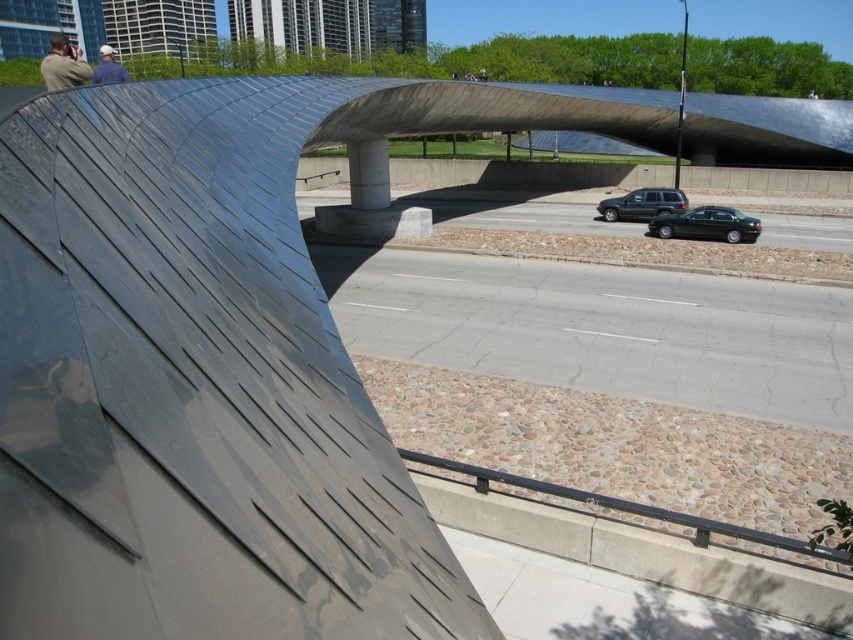
Does gray asphalt highway at center have a smaller size compared to blue denim jacket at upper left?

Yes.

Does gray asphalt highway at center have a greater height compared to blue denim jacket at upper left?

Incorrect, gray asphalt highway at center's height is not larger of blue denim jacket at upper left's.

The height and width of the screenshot is (640, 853). Find the location of `gray asphalt highway at center`. gray asphalt highway at center is located at coordinates (602, 328).

Identify the location of gray asphalt highway at center. (602, 328).

Is gray asphalt highway at center positioned in front of matte black jacket at upper left?

No, it is behind matte black jacket at upper left.

Can you confirm if gray asphalt highway at center is taller than matte black jacket at upper left?

No, gray asphalt highway at center is not taller than matte black jacket at upper left.

Where is `gray asphalt highway at center`? The width and height of the screenshot is (853, 640). gray asphalt highway at center is located at coordinates (602, 328).

Which is more to the right, matte black jacket at upper left or blue denim jacket at upper left?

blue denim jacket at upper left

Which is behind, point (48, 61) or point (105, 60)?

The point (105, 60) is more distant.

Find the location of a particular element. This screenshot has height=640, width=853. matte black jacket at upper left is located at coordinates (62, 65).